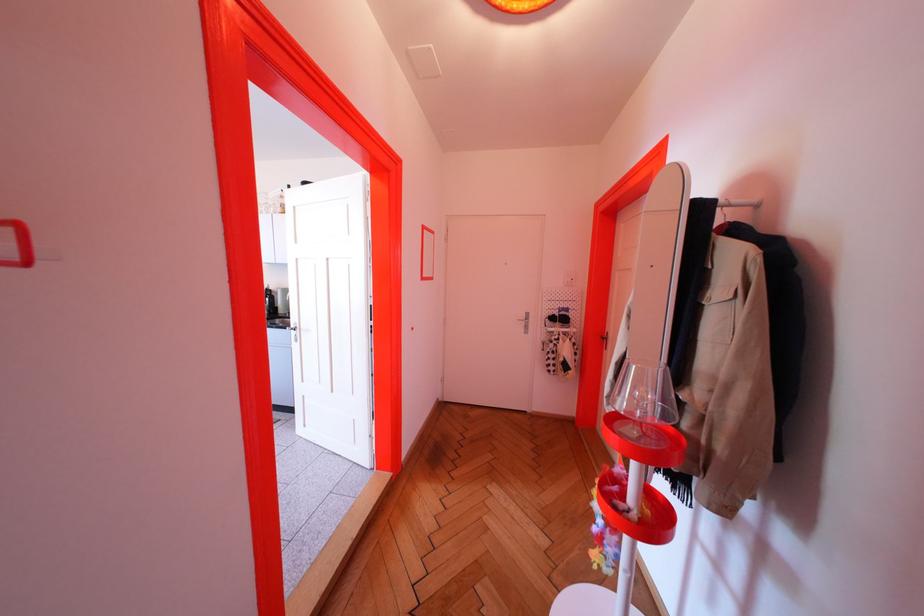
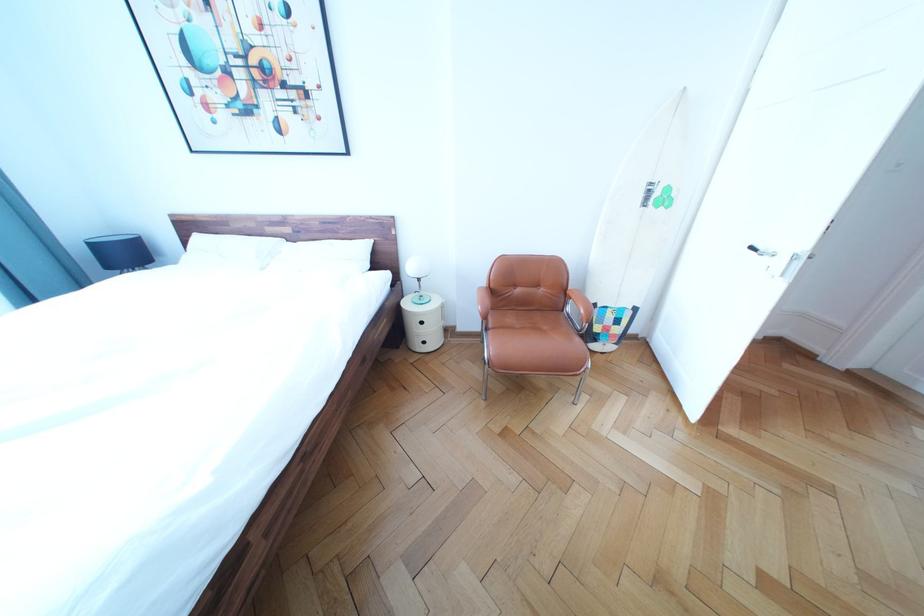
What movement of the cameraman would produce the second image?

The movement direction of the cameraman is left, backward.